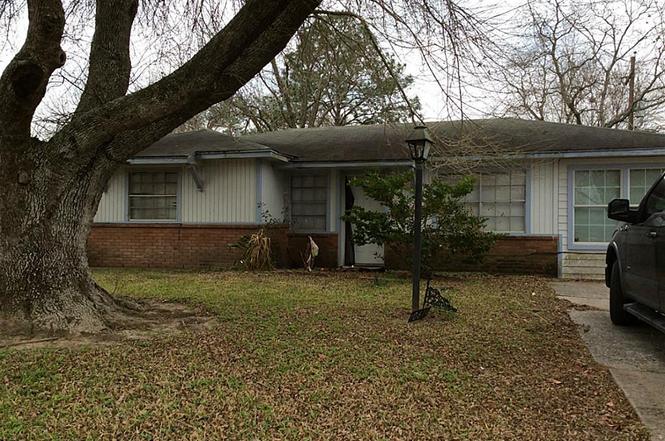
The width and height of the screenshot is (665, 441). I want to click on windows, so click(x=585, y=225).